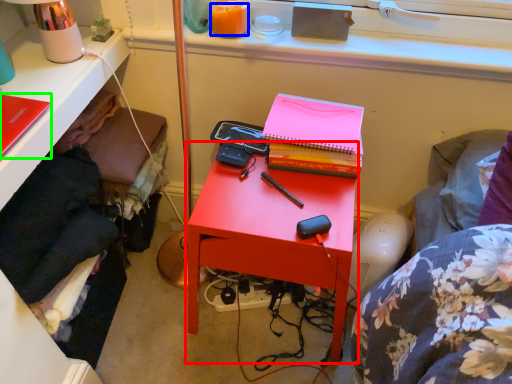
Question: Which is farther away from nightstand (highlighted by a red box)? orange juice (highlighted by a blue box) or notebook (highlighted by a green box)?

Choices:
 (A) orange juice
 (B) notebook

Answer: (B)